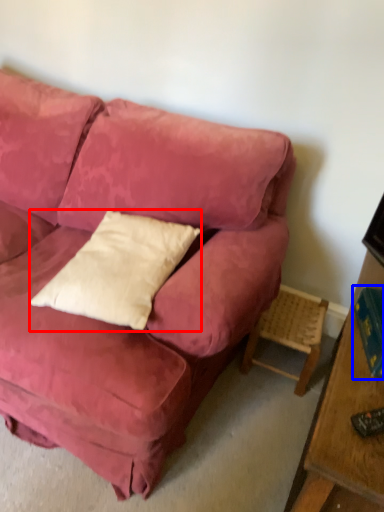
Question: Which object is closer to the camera taking this photo, pillow (highlighted by a red box) or book (highlighted by a blue box)?

Choices:
 (A) pillow
 (B) book

Answer: (A)